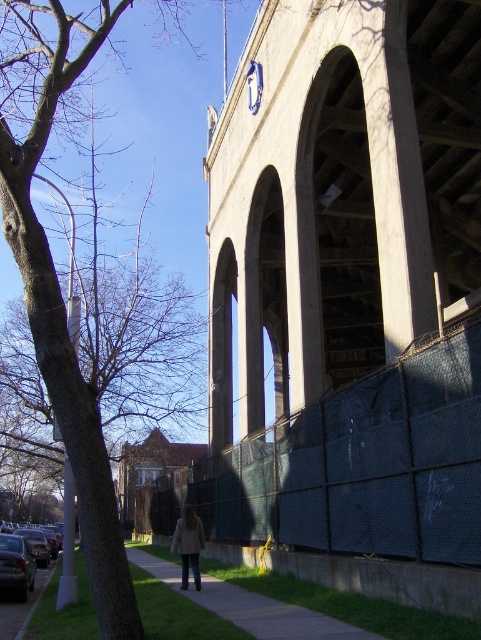
You are a landscape architect designing a new pathway between the dark green mesh fence at lower center and the brown leafless tree at left. What is the minimum length the pathway should be to connect them directly?

The dark green mesh fence at lower center and the brown leafless tree at left are 17.89 meters apart from each other, so the minimum length of the pathway should be 17.89 meters to connect them directly.

In the urban scene, you see a dark green mesh fence at lower center and a brown leafless tree at left. From the perspective of someone standing on the sidewalk, which object is closer to the right side?

The dark green mesh fence at lower center is positioned on the right side of brown leafless tree at left, so from the sidewalk perspective, the dark green mesh fence at lower center is closer to the right side.

You are a delivery person trying to navigate through the sidewalk. There is a dark green mesh fence at lower center and a brown leafless tree at left. Which object is closer to the ground?

The dark green mesh fence at lower center is positioned under the brown leafless tree at left, meaning it is closer to the ground.